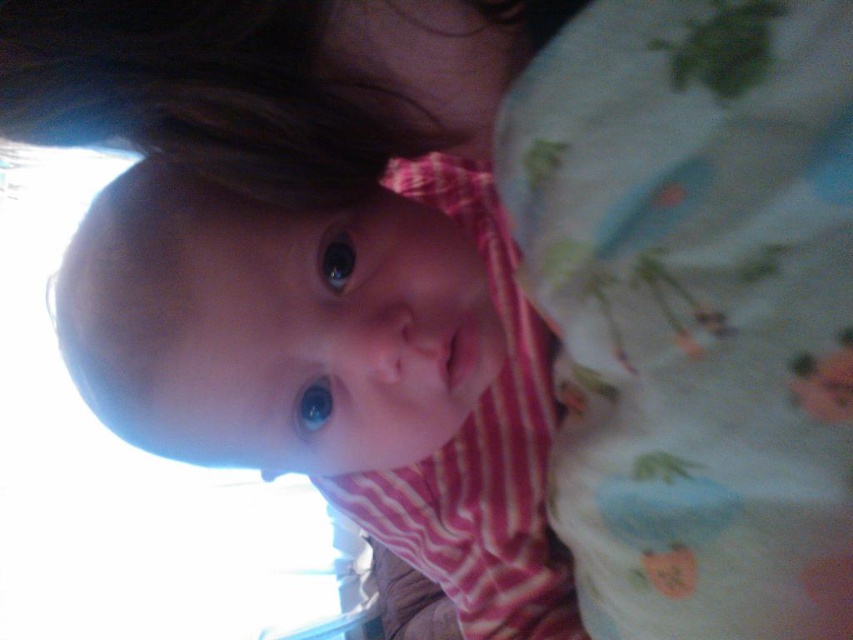
You are a photographer setting up a shoot for a baby photo session. You have a light blue cotton blanket at upper right and a pink striped shirt at center. Which item would you choose if you need a thinner fabric for the baby to lie comfortably?

The light blue cotton blanket at upper right is thinner than the pink striped shirt at center, so it would be more comfortable for the baby to lie on.

You are a photographer trying to capture the baby in the image. You need to place a small toy between the two points, point (761, 40) and point (119, 292). To ensure the toy is visible in the foreground, which point should you place it closer to?

To ensure the toy is visible in the foreground, place it closer to point (761, 40) because it is closer to the viewer than point (119, 292).